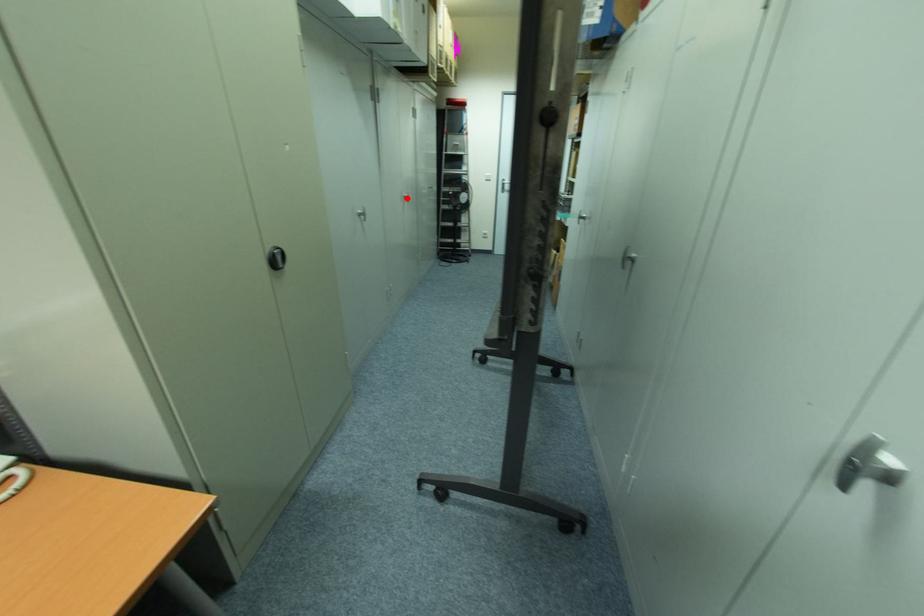
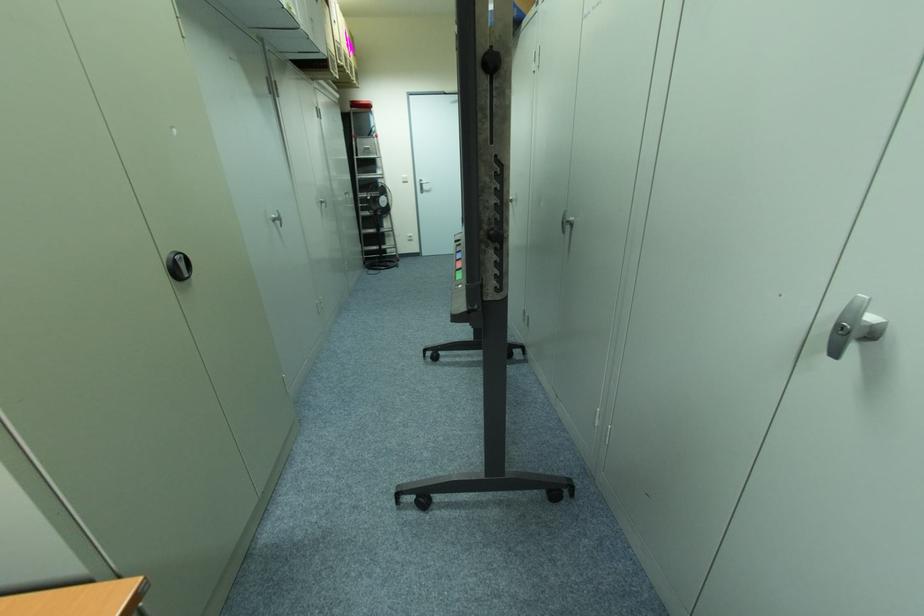
Question: A red point is marked in image1. In image2, is the corresponding 3D point closer to the camera or farther? Reply with the corresponding letter.

Choices:
 (A) The corresponding 3D point is closer.
 (B) The corresponding 3D point is farther.

Answer: (B)